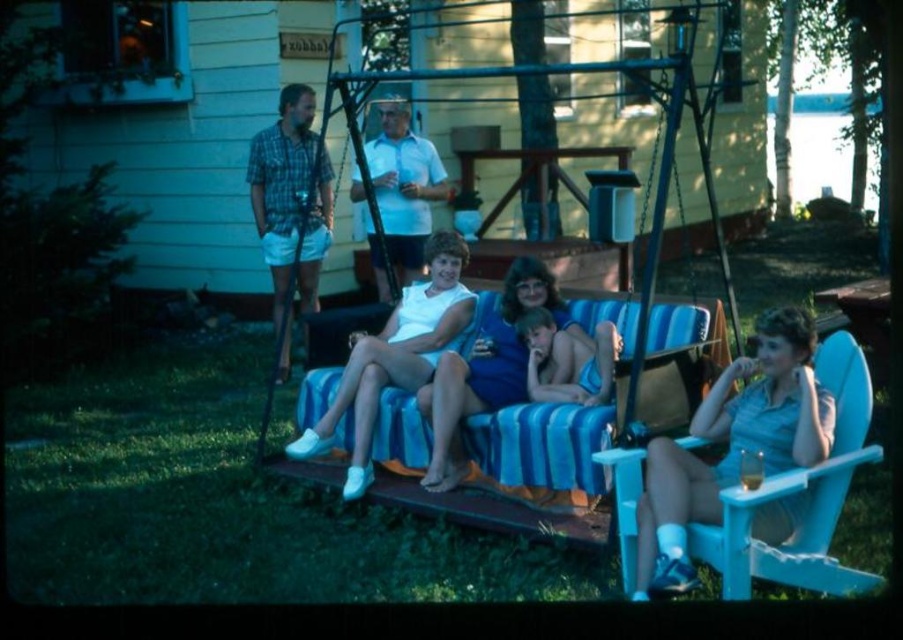
You are planning to place a small potted plant between the light blue plastic chair at right and the blue fabric shorts at center. Which object should the plant be closer to if it needs to be placed at a lower height?

The plant should be placed closer to the blue fabric shorts at center because it is shorter than the light blue plastic chair at right.

You are a photographer trying to capture the scene of the white matte swimsuit at center and the blue fabric shorts at center. Which object should you focus on first if you want to ensure both are in the frame?

The white matte swimsuit at center is below the blue fabric shorts at center, so you should focus on the blue fabric shorts at center first to ensure both are in the frame.